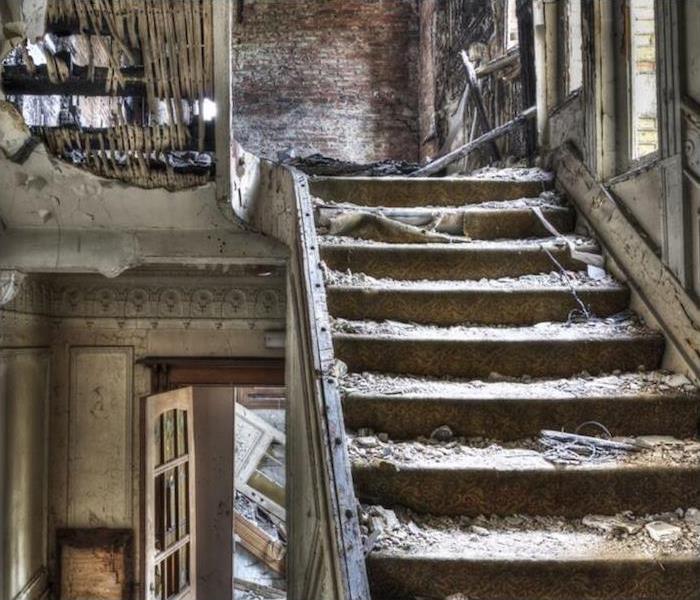
Find the location of a particular element. door is located at coordinates (256, 520).